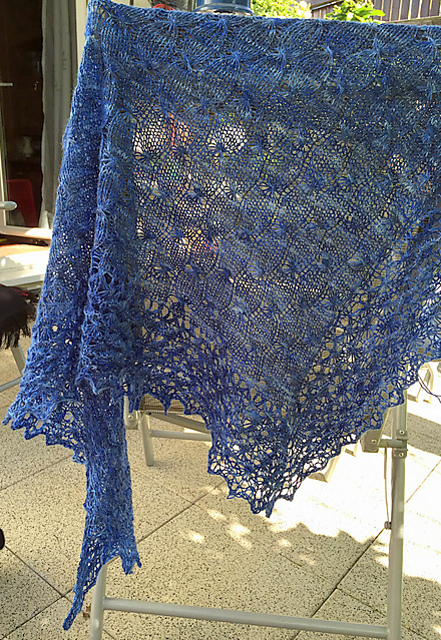
Where is `tile`? The height and width of the screenshot is (640, 441). tile is located at coordinates (340, 614).